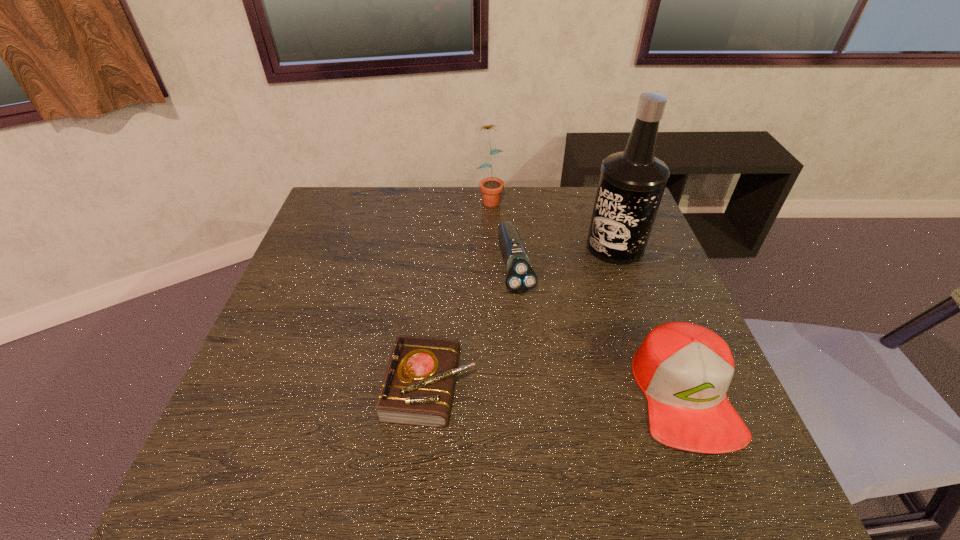
I want to click on baseball cap that is at the right edge, so click(x=684, y=370).

This screenshot has width=960, height=540. Find the location of `liquor present at the right edge`. liquor present at the right edge is located at coordinates (631, 185).

Where is `object that is positioned at the far right corner`? object that is positioned at the far right corner is located at coordinates (631, 185).

I want to click on object positioned at the near right corner, so click(684, 370).

This screenshot has width=960, height=540. In the image, there is a desktop. Find the location of `vacant space at the far edge`. vacant space at the far edge is located at coordinates (383, 214).

Locate an element on the screen. free space at the near edge of the desktop is located at coordinates (606, 406).

Where is `vacant space at the left edge`? Image resolution: width=960 pixels, height=540 pixels. vacant space at the left edge is located at coordinates (324, 264).

At what (x,y) coordinates should I click in order to perform the action: click on vacant area at the far left corner of the desktop. Please return your answer as a coordinate pair (x, y). This screenshot has height=540, width=960. Looking at the image, I should click on (337, 190).

Identify the location of free space at the near left corner. (253, 415).

The image size is (960, 540). I want to click on blank region between the fourth tallest object and the liquor, so click(x=565, y=256).